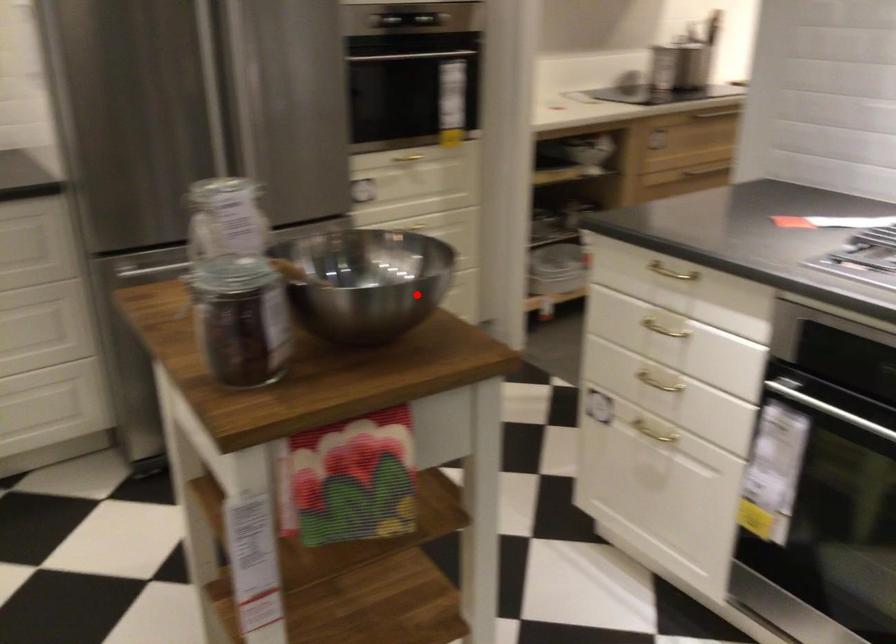
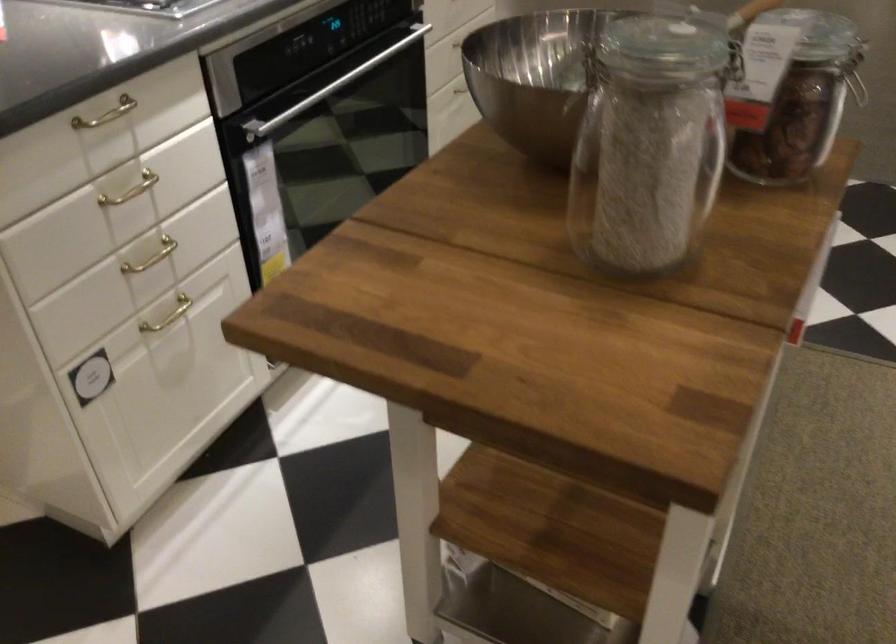
Question: I am providing you with two images of the same scene from different viewpoints. A red point is shown in image1. For the corresponding object point in image2, is it positioned nearer or farther from the camera?

Choices:
 (A) Nearer
 (B) Farther

Answer: (A)